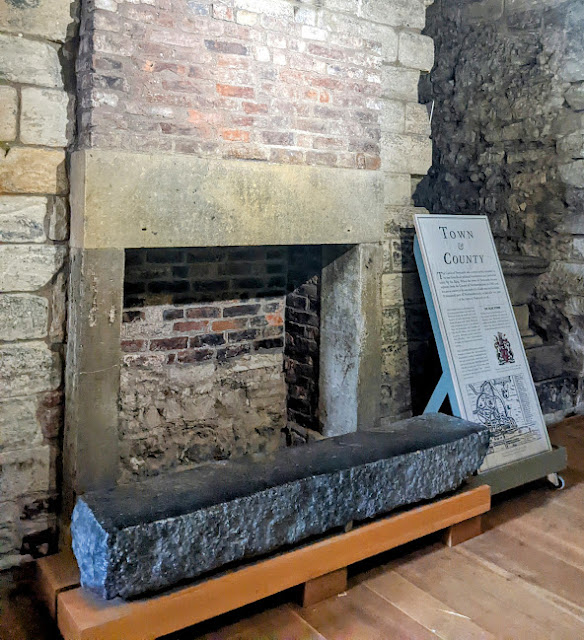
Find the location of a particular element. This screenshot has width=584, height=640. fireplace is located at coordinates (205, 390).